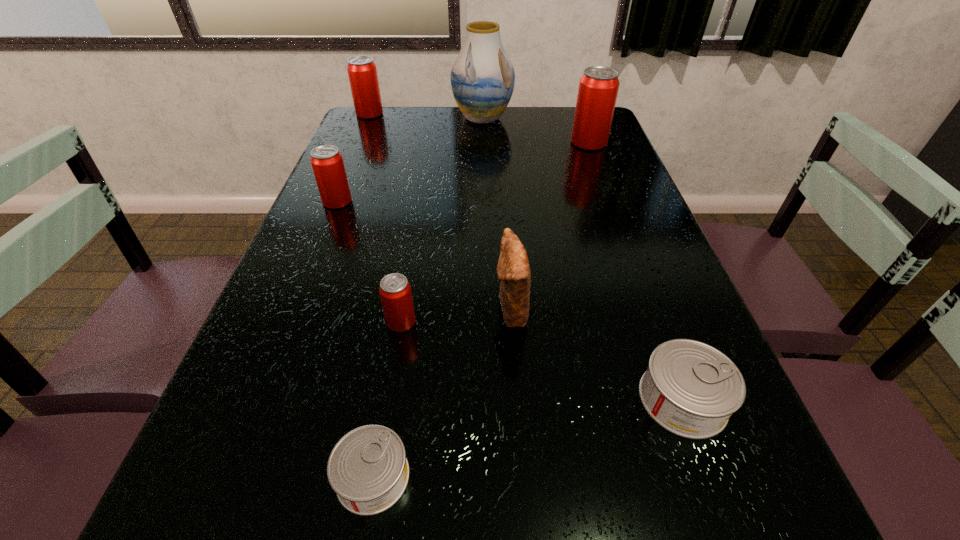
This screenshot has height=540, width=960. I want to click on the seventh farthest object, so click(691, 389).

You are a GUI agent. You are given a task and a screenshot of the screen. Output one action in this format:
    pyautogui.click(x=<x>, y=<y>)
    Task: Click on the seventh tallest object
    This screenshot has width=960, height=540.
    Given the screenshot: What is the action you would take?
    pyautogui.click(x=691, y=389)

Where is `the shortest can`? This screenshot has height=540, width=960. the shortest can is located at coordinates (368, 470).

Identify the location of the left silver can. The width and height of the screenshot is (960, 540). (368, 470).

Find the location of a particular element. The image size is (960, 540). blank space located 0.350m on the front of the vase is located at coordinates (483, 192).

The height and width of the screenshot is (540, 960). In order to click on free space located 0.390m on the front of the rightmost red can in this screenshot , I will do `click(621, 230)`.

Locate an element on the screen. This screenshot has width=960, height=540. free region located on the right of the farthest red can is located at coordinates (466, 114).

You are a GUI agent. You are given a task and a screenshot of the screen. Output one action in this format:
    pyautogui.click(x=<x>, y=<y>)
    Task: Click on the vacant point located on the open side of the clutch bag
    The height and width of the screenshot is (540, 960).
    Given the screenshot: What is the action you would take?
    pyautogui.click(x=386, y=309)

You are a GUI agent. You are given a task and a screenshot of the screen. Output one action in this format:
    pyautogui.click(x=<x>, y=<y>)
    Task: Click on the free space located on the open side of the clutch bag
    
    Given the screenshot: What is the action you would take?
    pyautogui.click(x=366, y=309)

The height and width of the screenshot is (540, 960). What are the coordinates of `vacant space situated on the open side of the clutch bag` in the screenshot? It's located at (311, 309).